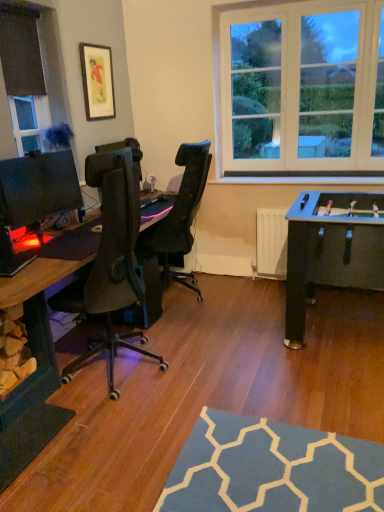
Question: Is matte black monitor at left oriented away from matte gold picture frame at upper left?

Choices:
 (A) no
 (B) yes

Answer: (A)

Question: From the image's perspective, is matte black monitor at left over matte gold picture frame at upper left?

Choices:
 (A) no
 (B) yes

Answer: (A)

Question: Can you confirm if matte black monitor at left is taller than matte gold picture frame at upper left?

Choices:
 (A) no
 (B) yes

Answer: (A)

Question: Does matte black monitor at left appear on the left side of matte gold picture frame at upper left?

Choices:
 (A) no
 (B) yes

Answer: (B)

Question: Is the surface of matte black monitor at left in direct contact with matte gold picture frame at upper left?

Choices:
 (A) yes
 (B) no

Answer: (B)

Question: Is there a large distance between matte black monitor at left and matte gold picture frame at upper left?

Choices:
 (A) yes
 (B) no

Answer: (B)

Question: Considering the relative sizes of matte black desk at left and black fabric at upper left in the image provided, is matte black desk at left shorter than black fabric at upper left?

Choices:
 (A) yes
 (B) no

Answer: (A)

Question: From the image's perspective, is matte black desk at left on top of black fabric at upper left?

Choices:
 (A) no
 (B) yes

Answer: (A)

Question: Does matte black desk at left have a greater width compared to black fabric at upper left?

Choices:
 (A) no
 (B) yes

Answer: (B)

Question: Is the depth of matte black desk at left less than that of black fabric at upper left?

Choices:
 (A) yes
 (B) no

Answer: (A)

Question: From a real-world perspective, does matte black desk at left stand above black fabric at upper left?

Choices:
 (A) no
 (B) yes

Answer: (A)

Question: Can you confirm if matte black desk at left is smaller than black fabric at upper left?

Choices:
 (A) no
 (B) yes

Answer: (A)

Question: From the image's perspective, is black fabric at upper left located above matte gold picture frame at upper left?

Choices:
 (A) no
 (B) yes

Answer: (A)